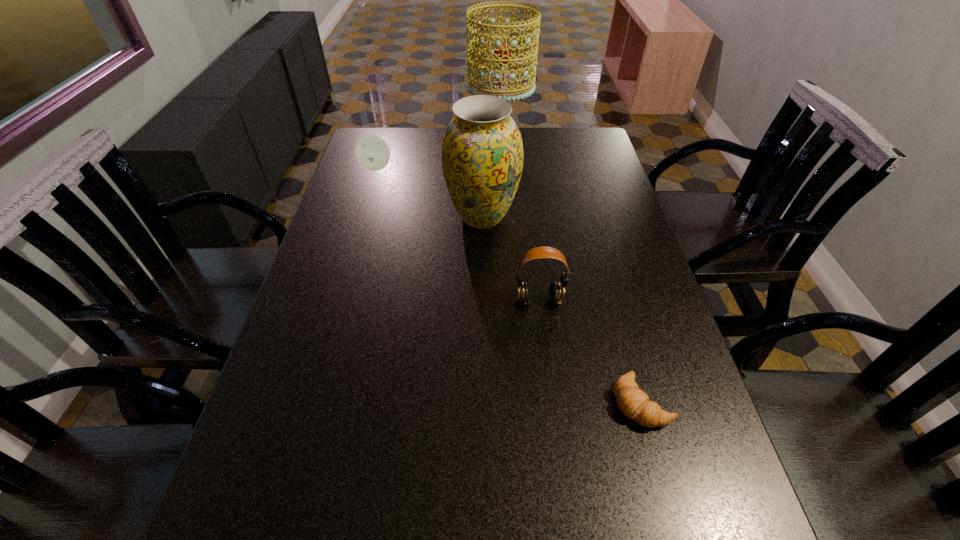
At what (x,y) coordinates should I click in order to perform the action: click on unoccupied position between the fourth shortest object and the second nearest object. Please return your answer as a coordinate pair (x, y). This screenshot has height=540, width=960. Looking at the image, I should click on (511, 259).

Point out which object is positioned as the third nearest to the lampshade. Please provide its 2D coordinates. Your answer should be formatted as a tuple, i.e. [(x, y)], where the tuple contains the x and y coordinates of a point satisfying the conditions above.

[(556, 294)]

Select which object appears as the second closest to the lampshade. Please provide its 2D coordinates. Your answer should be formatted as a tuple, i.e. [(x, y)], where the tuple contains the x and y coordinates of a point satisfying the conditions above.

[(372, 152)]

This screenshot has width=960, height=540. I want to click on free location that satisfies the following two spatial constraints: 1. on the front side of the tallest object; 2. on the right side of the nearest object, so click(515, 402).

At what (x,y) coordinates should I click in order to perform the action: click on free space that satisfies the following two spatial constraints: 1. on the back side of the vase; 2. on the left side of the tallest object. Please return your answer as a coordinate pair (x, y). This screenshot has width=960, height=540. Looking at the image, I should click on (482, 146).

Locate an element on the screen. The width and height of the screenshot is (960, 540). vacant space that satisfies the following two spatial constraints: 1. on the back side of the lampshade; 2. on the right side of the fourth shortest object is located at coordinates (482, 146).

This screenshot has height=540, width=960. I want to click on vacant space that satisfies the following two spatial constraints: 1. on the front side of the leftmost object; 2. on the right side of the second tallest object, so click(361, 217).

Where is `blank area in the image that satisfies the following two spatial constraints: 1. on the ear cups of the crescent roll; 2. on the left side of the headset`? blank area in the image that satisfies the following two spatial constraints: 1. on the ear cups of the crescent roll; 2. on the left side of the headset is located at coordinates (551, 402).